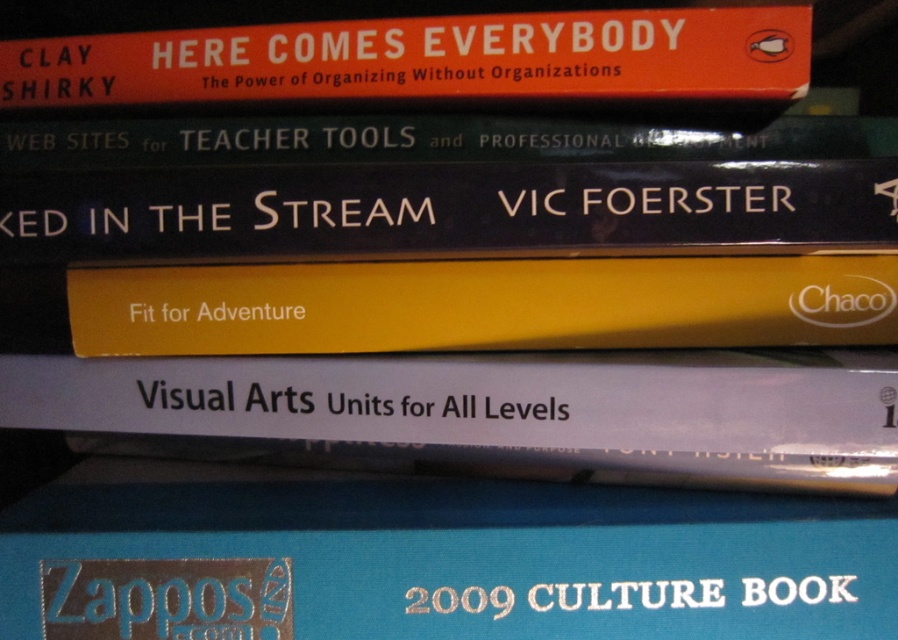
You are organizing a library shelf and need to place the black matte book at center and the yellow matte book at center. According to the image, which book should be placed to the left side of the shelf?

The black matte book at center should be placed to the left side of the shelf because it is to the left of the yellow matte book at center in the image.

You are a student who needs to place a 15 cm ruler between the white paper at center and the green matte book at center. Can the ruler fit in the space between them?

The distance between the white paper at center and the green matte book at center is 14.87 centimeters, which is slightly less than 15 cm. Therefore, the ruler cannot fit in the space between them.

You are organizing a library shelf and need to place the blue hardcover book at lower center and the black matte book at center. According to the arrangement shown, which book should be placed on top of the other?

The blue hardcover book at lower center is positioned under the black matte book at center, so the black matte book at center should be placed on top of the blue hardcover book at lower center.